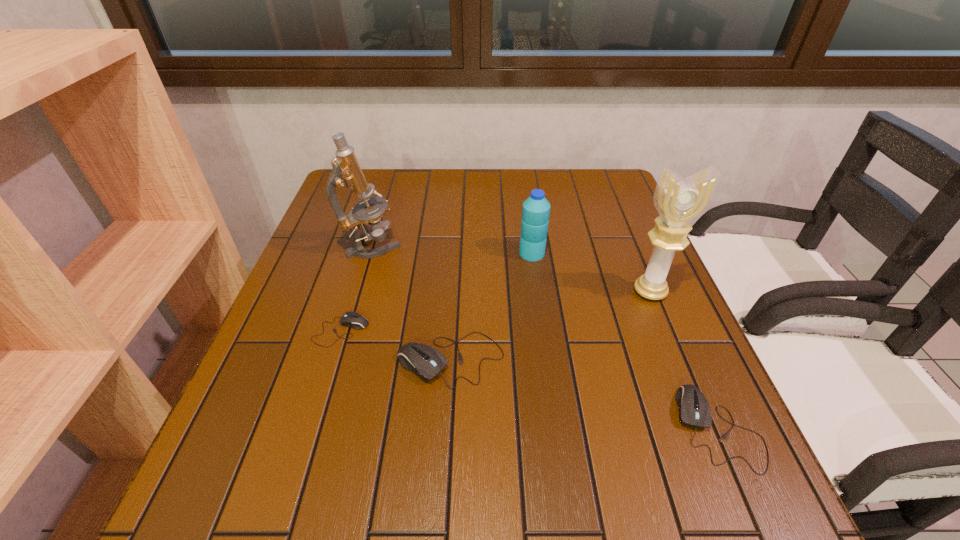
Please point a location where one more mouse_(computer_equipment) can be added evenly. Please provide its 2D coordinates. Your answer should be formatted as a tuple, i.e. [(x, y)], where the tuple contains the x and y coordinates of a point satisfying the conditions above.

[(576, 392)]